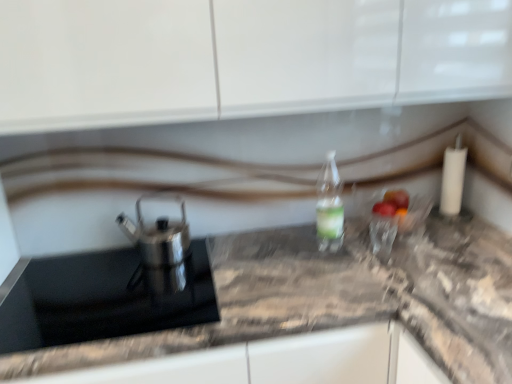
At what (x,y) coordinates should I click in order to perform the action: click on free space above marble gray countertop at center (from a real-world perspective). Please return your answer as a coordinate pair (x, y). Looking at the image, I should click on (301, 269).